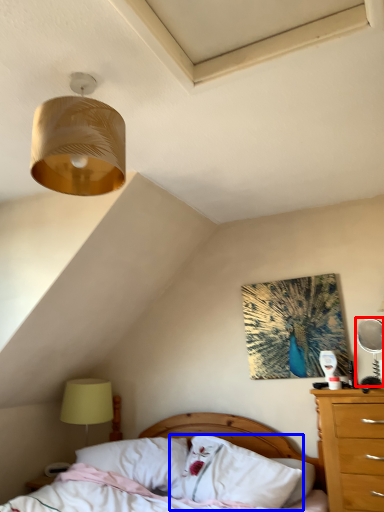
Question: Which point is further to the camera, mechanical fan (highlighted by a red box) or pillow (highlighted by a blue box)?

Choices:
 (A) mechanical fan
 (B) pillow

Answer: (A)